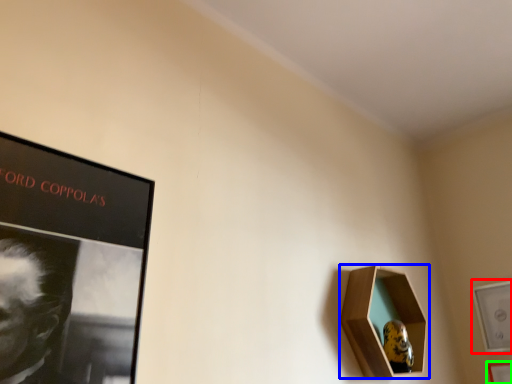
Question: Based on their relative distances, which object is farther from picture frame (highlighted by a red box)? Choose from picture frame (highlighted by a blue box) and picture frame (highlighted by a green box).

Choices:
 (A) picture frame
 (B) picture frame

Answer: (A)